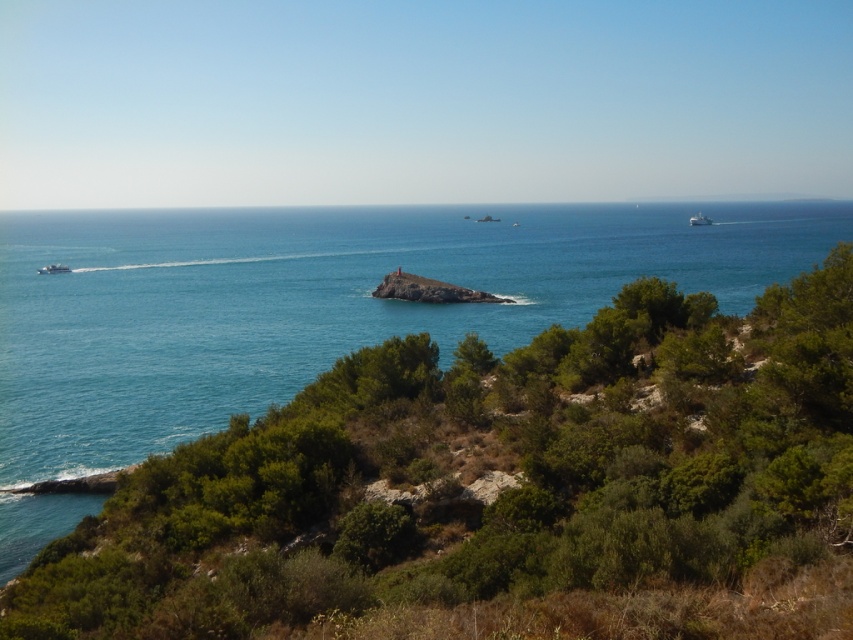
Question: Is the position of metallic silver boat at left less distant than that of white matte boat at upper right?

Choices:
 (A) yes
 (B) no

Answer: (A)

Question: Which object is closer to the camera taking this photo?

Choices:
 (A) metallic silver boat at left
 (B) white matte boat at upper right

Answer: (A)

Question: Does metallic silver boat at left come in front of white matte boat at upper right?

Choices:
 (A) yes
 (B) no

Answer: (A)

Question: Which is nearer to the white matte boat at upper right?

Choices:
 (A) blue water at center
 (B) metallic silver boat at left

Answer: (A)

Question: Is blue water at center thinner than metallic silver boat at left?

Choices:
 (A) no
 (B) yes

Answer: (A)

Question: Which of the following is the closest to the observer?

Choices:
 (A) white matte boat at upper right
 (B) metallic silver boat at left
 (C) blue water at center

Answer: (C)